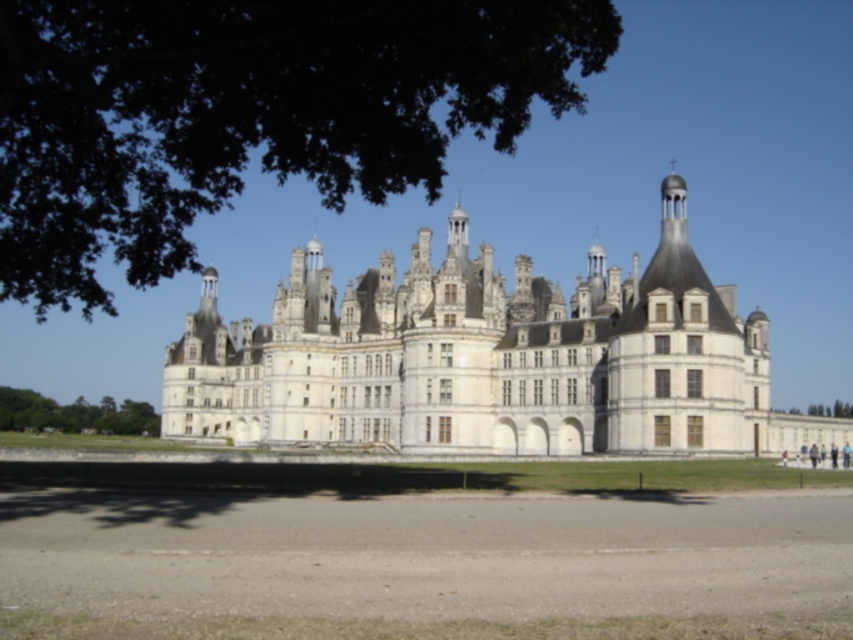
You are standing in front of the historic building and want to take a photo. There are two points marked in the image, point 1 at coordinates point (670, 259) and point 2 at coordinates point (129, 400). Which point will appear larger in your photo?

Point (670, 259) is closer to the camera than point (129, 400), so it will appear larger in the photo.

You are standing at the entrance of the white stone castle at center and want to take a photo of the green leafy tree at lower left. In which direction should you turn to face the tree?

You should turn to your left to face the green leafy tree at lower left since the white stone castle at center is to the right of the tree.

You are standing in front of the grand historic building and notice two trees. One is the dark green leafy tree at upper left and the other is the green leafy tree at lower left. Which tree would cast a longer shadow on the ground?

The dark green leafy tree at upper left is much taller than the green leafy tree at lower left, so its shadow would be longer.